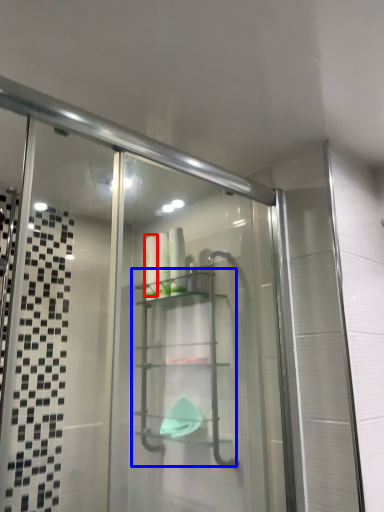
Question: Among these objects, which one is farthest to the camera, toiletry (highlighted by a red box) or glass box (highlighted by a blue box)?

Choices:
 (A) toiletry
 (B) glass box

Answer: (A)